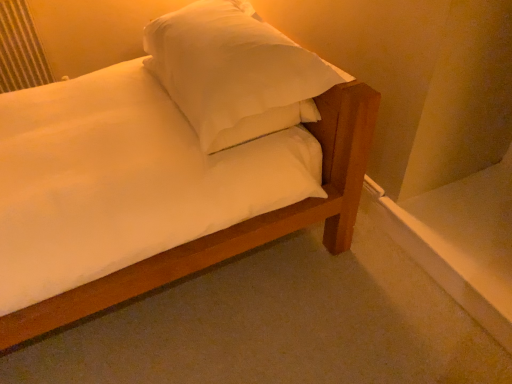
Question: Considering the relative sizes of white soft pillow at upper center and white matte bed at center in the image provided, is white soft pillow at upper center smaller than white matte bed at center?

Choices:
 (A) no
 (B) yes

Answer: (A)

Question: Can you confirm if white soft pillow at upper center is thinner than white matte bed at center?

Choices:
 (A) yes
 (B) no

Answer: (A)

Question: From the image's perspective, is white soft pillow at upper center over white matte bed at center?

Choices:
 (A) no
 (B) yes

Answer: (B)

Question: Is white soft pillow at upper center outside of white matte bed at center?

Choices:
 (A) yes
 (B) no

Answer: (B)

Question: From a real-world perspective, is white soft pillow at upper center physically below white matte bed at center?

Choices:
 (A) no
 (B) yes

Answer: (A)

Question: Does point (345, 200) appear closer or farther from the camera than point (284, 79)?

Choices:
 (A) farther
 (B) closer

Answer: (A)

Question: Relative to white soft pillow at upper center, is white matte bed at center in front or behind?

Choices:
 (A) behind
 (B) front

Answer: (A)

Question: Choose the correct answer: Is white matte bed at center inside white soft pillow at upper center or outside it?

Choices:
 (A) outside
 (B) inside

Answer: (B)

Question: Considering the positions of white matte bed at center and white soft pillow at upper center in the image, is white matte bed at center bigger or smaller than white soft pillow at upper center?

Choices:
 (A) big
 (B) small

Answer: (B)

Question: From a real-world perspective, is metallic silver radiator at upper left positioned above or below white matte bed at center?

Choices:
 (A) above
 (B) below

Answer: (B)

Question: Considering the relative positions of metallic silver radiator at upper left and white matte bed at center in the image provided, is metallic silver radiator at upper left to the left or to the right of white matte bed at center?

Choices:
 (A) right
 (B) left

Answer: (B)

Question: Does point (2, 71) appear closer or farther from the camera than point (366, 153)?

Choices:
 (A) farther
 (B) closer

Answer: (A)

Question: Is metallic silver radiator at upper left in front of or behind white matte bed at center in the image?

Choices:
 (A) behind
 (B) front

Answer: (A)

Question: From the image's perspective, relative to metallic silver radiator at upper left, is white soft pillow at upper center above or below?

Choices:
 (A) above
 (B) below

Answer: (B)

Question: Looking at their shapes, would you say white soft pillow at upper center is wider or thinner than metallic silver radiator at upper left?

Choices:
 (A) thin
 (B) wide

Answer: (B)